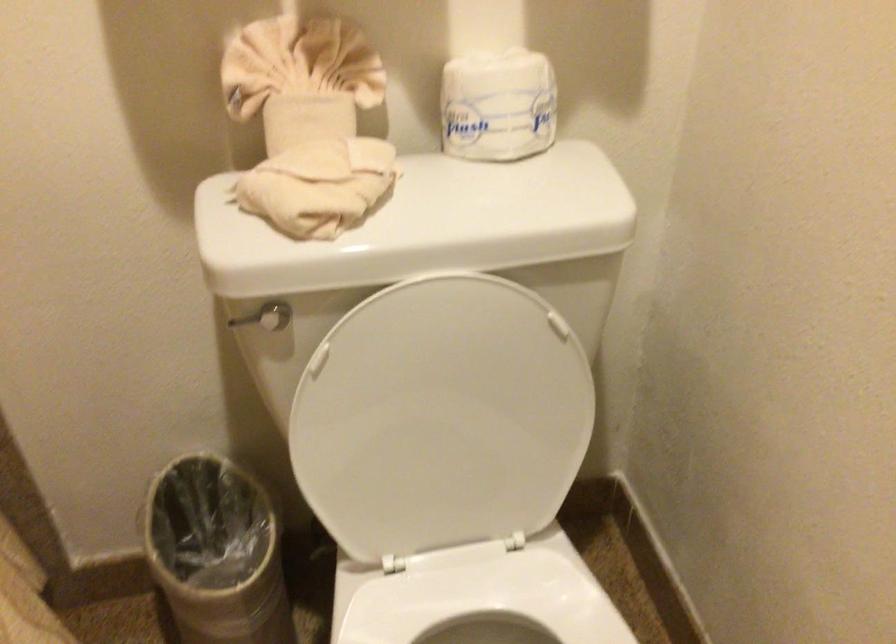
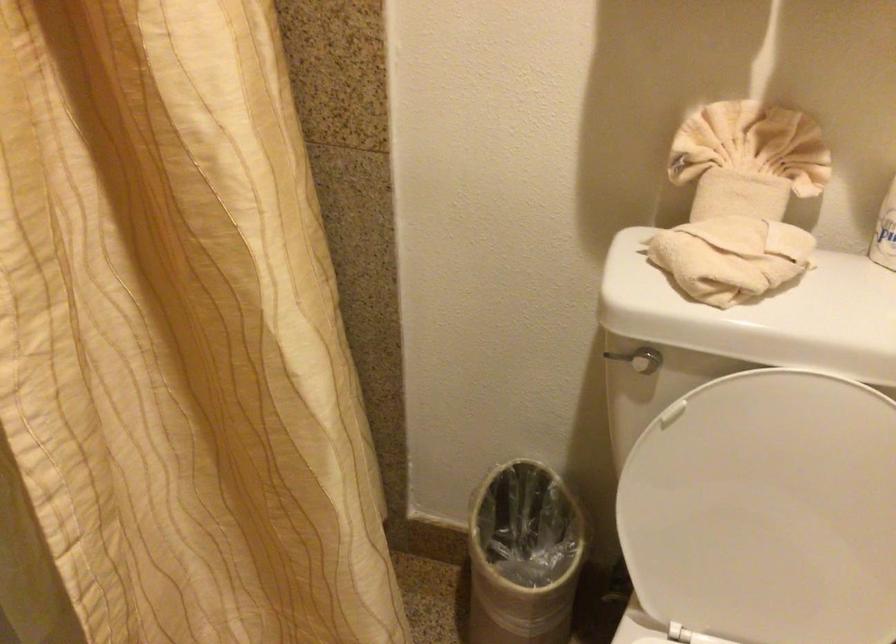
Question: The camera is either moving clockwise (left) or counter-clockwise (right) around the object. The first image is from the beginning of the video and the second image is from the end. Is the camera moving left or right when shooting the video?

Choices:
 (A) Left
 (B) Right

Answer: (B)